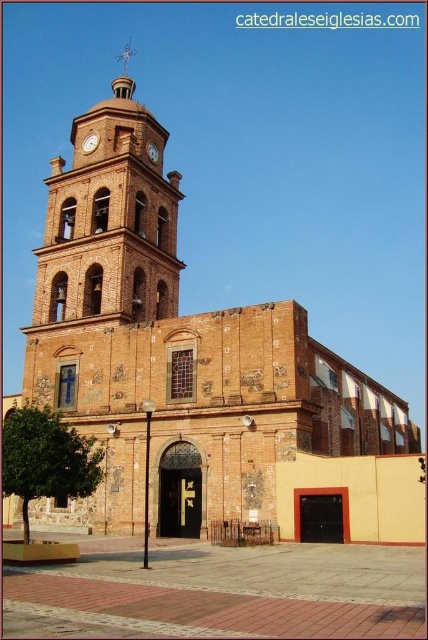
You are standing in front of the historic church and want to take a photo of the point at coordinates point (88, 141). If you are 100 feet away from the church, will you be able to capture the point in your photo?

The point (88, 141) is 193.96 feet from the camera. Since you are only 100 feet away from the church, you are closer than the point, so the point would be behind you and not visible in the photo.

Looking at this image, you are an architect inspecting the church facade. You notice the wooden clock at center and the matte brown clock at upper center. Which clock appears narrower when viewed from the ground?

The wooden clock at center has a lesser width compared to the matte brown clock at upper center, so it appears narrower.

You are an architect designing a new addition to the church. You need to place a new statue between the brown brick bell tower at center and the wooden clock at center. Which side of the statue should face the wider structure?

The brown brick bell tower at center has a larger width than the wooden clock at center. Therefore, the statue should face the brown brick bell tower at center since it is wider.